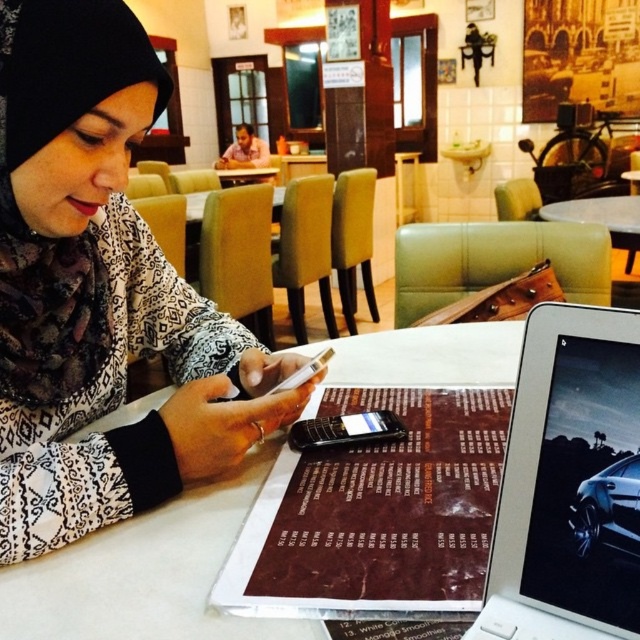
Is matte black phone at center wider than white glossy table at center?

In fact, matte black phone at center might be narrower than white glossy table at center.

Between matte black phone at center and white glossy table at center, which one is positioned higher?

white glossy table at center

Does point (193, 406) come closer to viewer compared to point (577, 212)?

Yes, it is in front of point (577, 212).

Find the location of a particular element. matte black phone at center is located at coordinates (99, 291).

Is matte black phone at center below black glossy smartphone at center?

No.

Which of these two, matte black phone at center or black glossy smartphone at center, stands taller?

matte black phone at center

Measure the distance between matte black phone at center and camera.

matte black phone at center and camera are 18.15 inches apart.

You are a GUI agent. You are given a task and a screenshot of the screen. Output one action in this format:
    pyautogui.click(x=<x>, y=<y>)
    Task: Click on the matte black phone at center
    This screenshot has width=640, height=640.
    Given the screenshot: What is the action you would take?
    pyautogui.click(x=99, y=291)

Is brown paper menu at center wider than white glossy table at center?

No.

Measure the distance between brown paper menu at center and camera.

brown paper menu at center and camera are 38.77 centimeters apart.

Locate an element on the screen. brown paper menu at center is located at coordinates (376, 513).